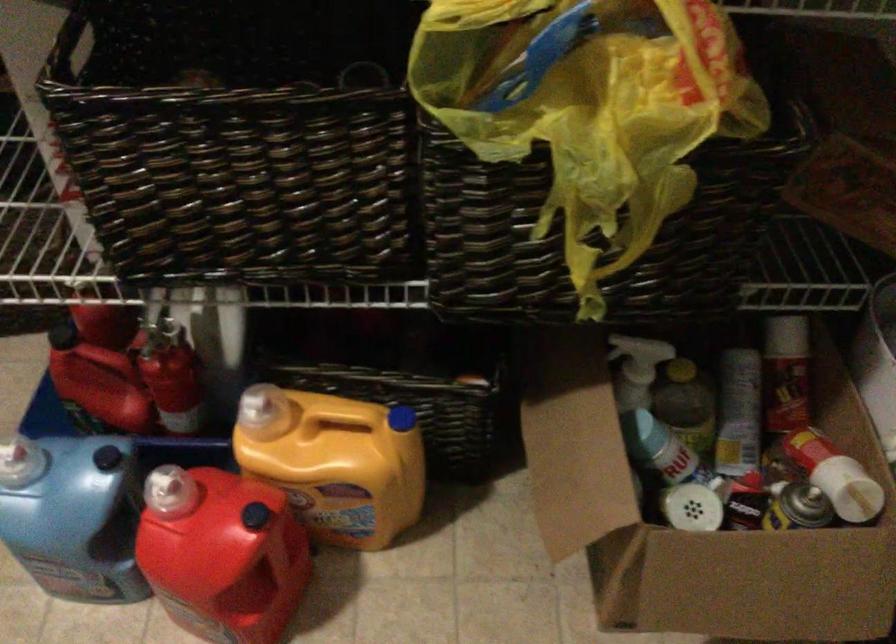
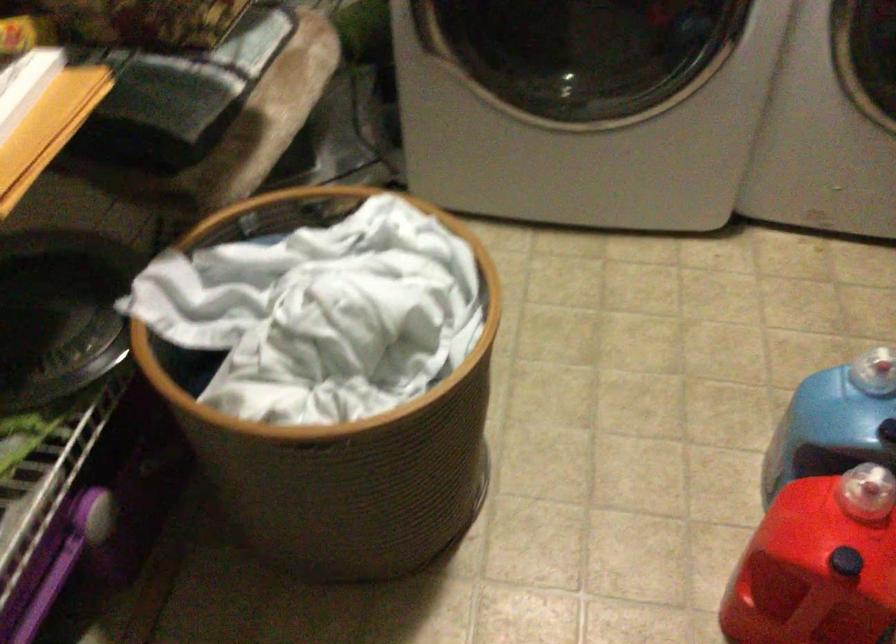
Where in the second image is the point corresponding to [238,509] from the first image?

(846, 562)